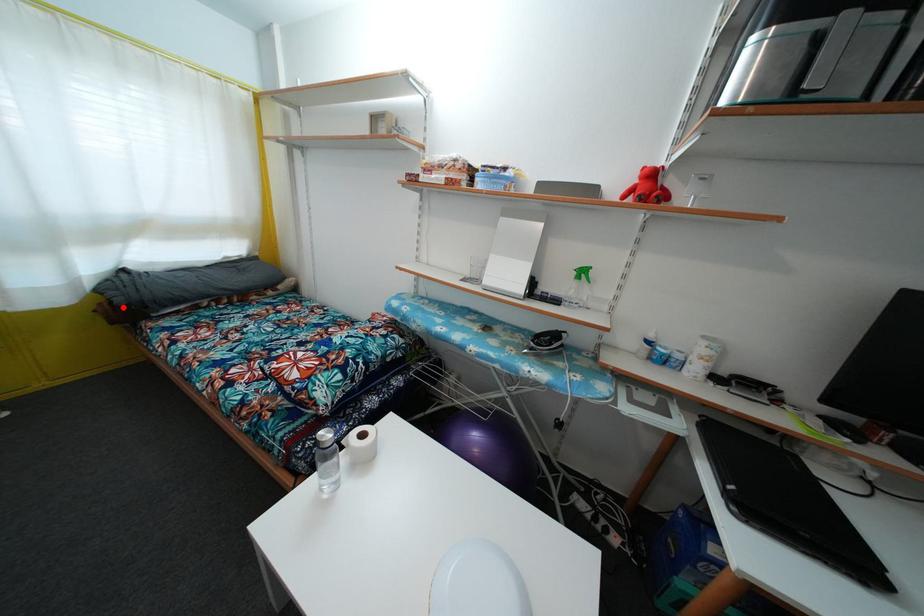
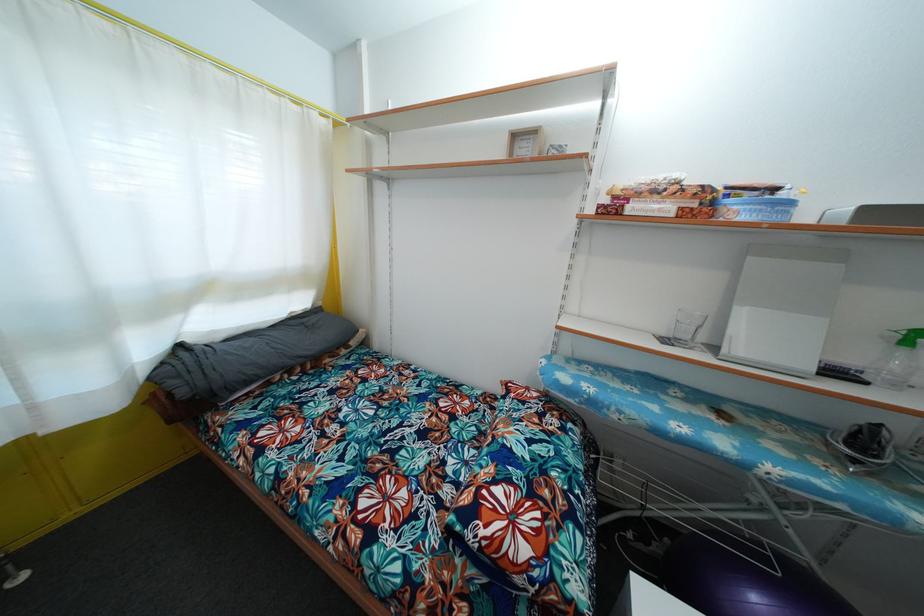
Question: I am providing you with two images of the same scene from different viewpoints. In image1, a red point is highlighted. Considering the same 3D point in image2, which of the following is correct?

Choices:
 (A) It is closer
 (B) It is farther

Answer: (B)